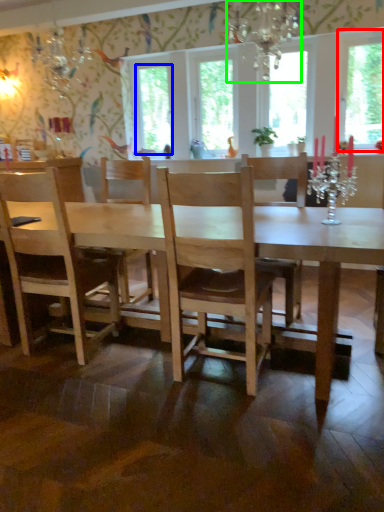
Question: Based on their relative distances, which object is farther from window screen (highlighted by a red box)? Choose from window screen (highlighted by a blue box) and light fixture (highlighted by a green box).

Choices:
 (A) window screen
 (B) light fixture

Answer: (A)